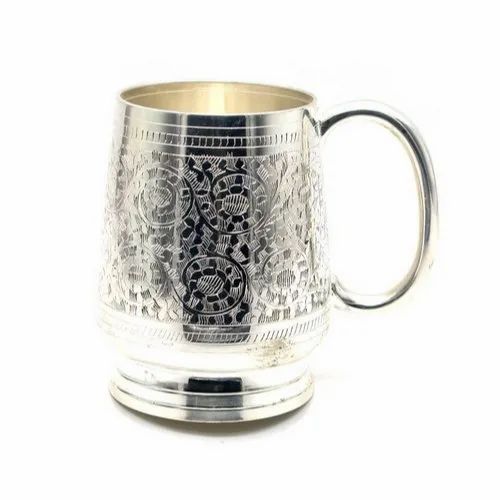
At what (x,y) coordinates should I click in order to perform the action: click on handle. Please return your answer as a coordinate pair (x, y). The image size is (500, 500). Looking at the image, I should click on (394, 121).